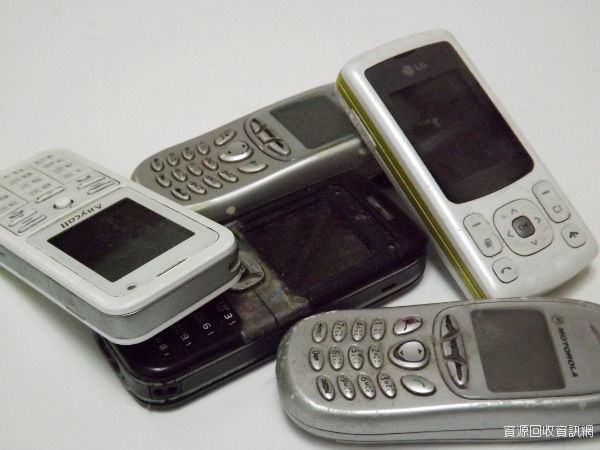
Locate an element on the screen. screens is located at coordinates (138, 223), (314, 118), (316, 241), (444, 125), (515, 360).